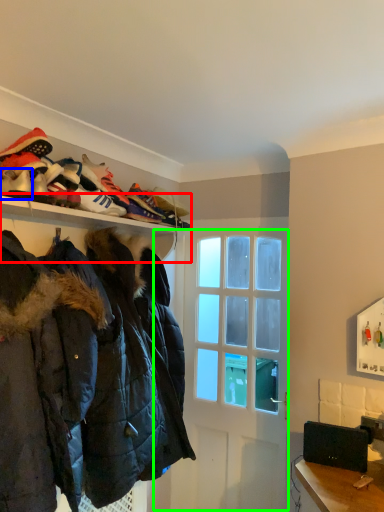
Question: Considering the real-world distances, which object is closest to shelf (highlighted by a red box)? footwear (highlighted by a blue box) or glass door (highlighted by a green box).

Choices:
 (A) footwear
 (B) glass door

Answer: (A)